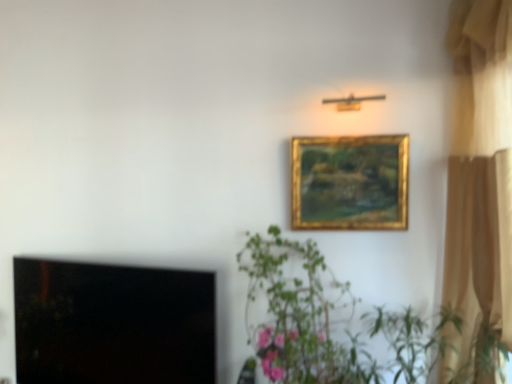
Question: Does black glass window screen at lower left come behind green leafy plant at center?

Choices:
 (A) yes
 (B) no

Answer: (A)

Question: Is black glass window screen at lower left touching green leafy plant at center?

Choices:
 (A) yes
 (B) no

Answer: (B)

Question: Is black glass window screen at lower left oriented towards green leafy plant at center?

Choices:
 (A) yes
 (B) no

Answer: (B)

Question: Considering the relative sizes of black glass window screen at lower left and green leafy plant at center in the image provided, is black glass window screen at lower left thinner than green leafy plant at center?

Choices:
 (A) no
 (B) yes

Answer: (B)

Question: Considering the relative sizes of black glass window screen at lower left and green leafy plant at center in the image provided, is black glass window screen at lower left taller than green leafy plant at center?

Choices:
 (A) yes
 (B) no

Answer: (B)

Question: Is green leafy plant at center surrounded by black glass window screen at lower left?

Choices:
 (A) no
 (B) yes

Answer: (A)

Question: Would you say beige fabric curtain at right is part of gold/gilded picture frame at upper center's contents?

Choices:
 (A) yes
 (B) no

Answer: (B)

Question: Is gold/gilded picture frame at upper center taller than beige fabric curtain at right?

Choices:
 (A) yes
 (B) no

Answer: (B)

Question: Is gold/gilded picture frame at upper center at the left side of beige fabric curtain at right?

Choices:
 (A) no
 (B) yes

Answer: (B)

Question: Can you confirm if gold/gilded picture frame at upper center is thinner than beige fabric curtain at right?

Choices:
 (A) yes
 (B) no

Answer: (A)

Question: Is gold/gilded picture frame at upper center positioned before beige fabric curtain at right?

Choices:
 (A) yes
 (B) no

Answer: (B)

Question: Can you confirm if gold/gilded picture frame at upper center is bigger than beige fabric curtain at right?

Choices:
 (A) yes
 (B) no

Answer: (B)

Question: Would you say black glass window screen at lower left is part of gold/gilded picture frame at upper center's contents?

Choices:
 (A) no
 (B) yes

Answer: (A)